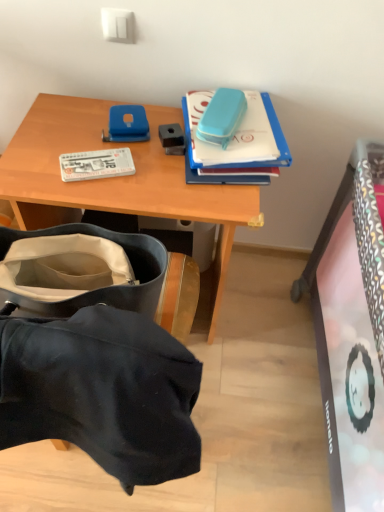
Identify the location of unoccupied region to the right of white matte book at left, the 1th book when ordered from left to right. (167, 177).